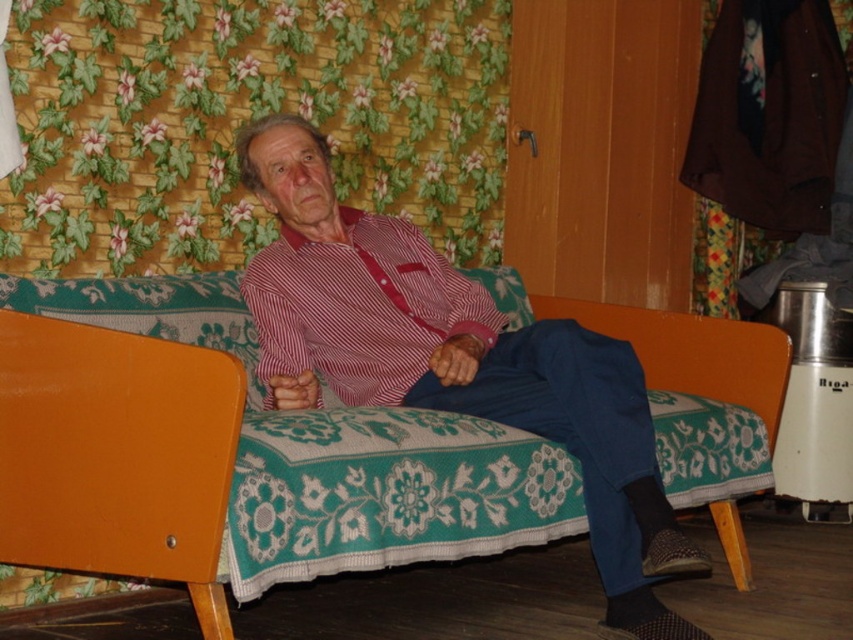
Which is above, matte red shirt at center or orange fabric couch at center?

matte red shirt at center is higher up.

Does matte red shirt at center have a greater width compared to orange fabric couch at center?

In fact, matte red shirt at center might be narrower than orange fabric couch at center.

Find the location of `matte red shirt at center`. matte red shirt at center is located at coordinates (457, 369).

Image resolution: width=853 pixels, height=640 pixels. What do you see at coordinates (360, 308) in the screenshot?
I see `striped cotton shirt at center` at bounding box center [360, 308].

Is point (381, 301) farther from camera compared to point (363, 232)?

No, it is in front of (363, 232).

Identify the location of striped cotton shirt at center. (360, 308).

Does point (569, 496) lie in front of point (325, 358)?

Yes.

Is orange fabric couch at center thinner than striped cotton shirt at center?

Incorrect, orange fabric couch at center's width is not less than striped cotton shirt at center's.

Is point (685, 488) less distant than point (306, 346)?

No, it is behind (306, 346).

Locate an element on the screen. orange fabric couch at center is located at coordinates (335, 452).